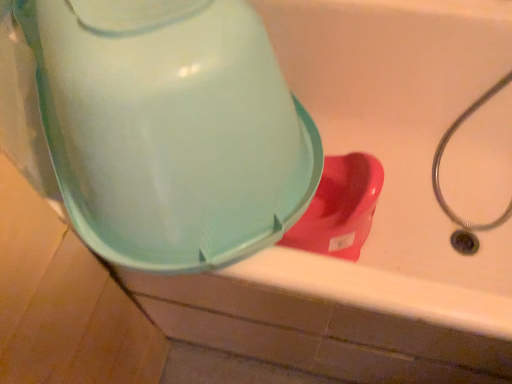
The image size is (512, 384). What do you see at coordinates (340, 208) in the screenshot?
I see `rubberized plastic toilet at lower right` at bounding box center [340, 208].

This screenshot has width=512, height=384. In order to click on rubberized plastic toilet at lower right in this screenshot , I will do `click(340, 208)`.

What is the approximate height of rubberized plastic toilet at lower right?

rubberized plastic toilet at lower right is 8.82 inches in height.

The width and height of the screenshot is (512, 384). What do you see at coordinates (170, 128) in the screenshot?
I see `matte plastic water cooler at upper left` at bounding box center [170, 128].

Find the location of a particular element. Image resolution: width=512 pixels, height=384 pixels. matte plastic water cooler at upper left is located at coordinates (170, 128).

Find the location of a particular element. The width and height of the screenshot is (512, 384). rubberized plastic toilet at lower right is located at coordinates (340, 208).

Which is more to the right, rubberized plastic toilet at lower right or matte plastic water cooler at upper left?

rubberized plastic toilet at lower right is more to the right.

Which object is closer to the camera taking this photo, rubberized plastic toilet at lower right or matte plastic water cooler at upper left?

matte plastic water cooler at upper left is in front.

Is point (367, 222) positioned behind point (185, 253)?

Yes.

From the image's perspective, is rubberized plastic toilet at lower right located above or below matte plastic water cooler at upper left?

Clearly, from the image's perspective, rubberized plastic toilet at lower right is below matte plastic water cooler at upper left.

From a real-world perspective, relative to matte plastic water cooler at upper left, is rubberized plastic toilet at lower right vertically above or below?

In terms of real-world spatial position, rubberized plastic toilet at lower right is below matte plastic water cooler at upper left.

Which object is thinner, rubberized plastic toilet at lower right or matte plastic water cooler at upper left?

Thinner between the two is rubberized plastic toilet at lower right.

Does rubberized plastic toilet at lower right have a lesser height compared to matte plastic water cooler at upper left?

Yes, rubberized plastic toilet at lower right is shorter than matte plastic water cooler at upper left.

Considering the relative sizes of rubberized plastic toilet at lower right and matte plastic water cooler at upper left in the image provided, is rubberized plastic toilet at lower right bigger than matte plastic water cooler at upper left?

Incorrect, rubberized plastic toilet at lower right is not larger than matte plastic water cooler at upper left.

Choose the correct answer: Is rubberized plastic toilet at lower right inside matte plastic water cooler at upper left or outside it?

rubberized plastic toilet at lower right is not enclosed by matte plastic water cooler at upper left.

Are rubberized plastic toilet at lower right and matte plastic water cooler at upper left located far from each other?

Actually, rubberized plastic toilet at lower right and matte plastic water cooler at upper left are a little close together.

Is rubberized plastic toilet at lower right looking in the opposite direction of matte plastic water cooler at upper left?

No, matte plastic water cooler at upper left is not at the back of rubberized plastic toilet at lower right.

What's the angular difference between rubberized plastic toilet at lower right and matte plastic water cooler at upper left's facing directions?

There is a 52.6-degree angle between the facing directions of rubberized plastic toilet at lower right and matte plastic water cooler at upper left.

Where is `water cooler above the rubberized plastic toilet at lower right (from a real-world perspective)`? This screenshot has height=384, width=512. water cooler above the rubberized plastic toilet at lower right (from a real-world perspective) is located at coordinates (170, 128).

Which is more to the right, matte plastic water cooler at upper left or rubberized plastic toilet at lower right?

Positioned to the right is rubberized plastic toilet at lower right.

Between matte plastic water cooler at upper left and rubberized plastic toilet at lower right, which one is positioned in front?

matte plastic water cooler at upper left is in front.

Does point (274, 221) come behind point (376, 188)?

No.

From the image's perspective, is matte plastic water cooler at upper left under rubberized plastic toilet at lower right?

No.

From a real-world perspective, which object stands above the other?

In real-world perspective, matte plastic water cooler at upper left is above.

Between matte plastic water cooler at upper left and rubberized plastic toilet at lower right, which one has smaller width?

With smaller width is rubberized plastic toilet at lower right.

Between matte plastic water cooler at upper left and rubberized plastic toilet at lower right, which one has more height?

matte plastic water cooler at upper left is taller.

Between matte plastic water cooler at upper left and rubberized plastic toilet at lower right, which one has larger size?

matte plastic water cooler at upper left.

Based on the photo, could rubberized plastic toilet at lower right be considered to be inside matte plastic water cooler at upper left?

No, rubberized plastic toilet at lower right is not surrounded by matte plastic water cooler at upper left.

Is matte plastic water cooler at upper left placed right next to rubberized plastic toilet at lower right?

No, matte plastic water cooler at upper left is not in contact with rubberized plastic toilet at lower right.

Does matte plastic water cooler at upper left turn towards rubberized plastic toilet at lower right?

No, matte plastic water cooler at upper left is not turned towards rubberized plastic toilet at lower right.

How different are the orientations of matte plastic water cooler at upper left and rubberized plastic toilet at lower right in degrees?

They differ by 52.6 degrees in their facing directions.

Where is `water cooler in front of the rubberized plastic toilet at lower right`? water cooler in front of the rubberized plastic toilet at lower right is located at coordinates (170, 128).

Find the location of a particular element. water cooler that is in front of the rubberized plastic toilet at lower right is located at coordinates (170, 128).

Identify the location of toilet behind the matte plastic water cooler at upper left. (340, 208).